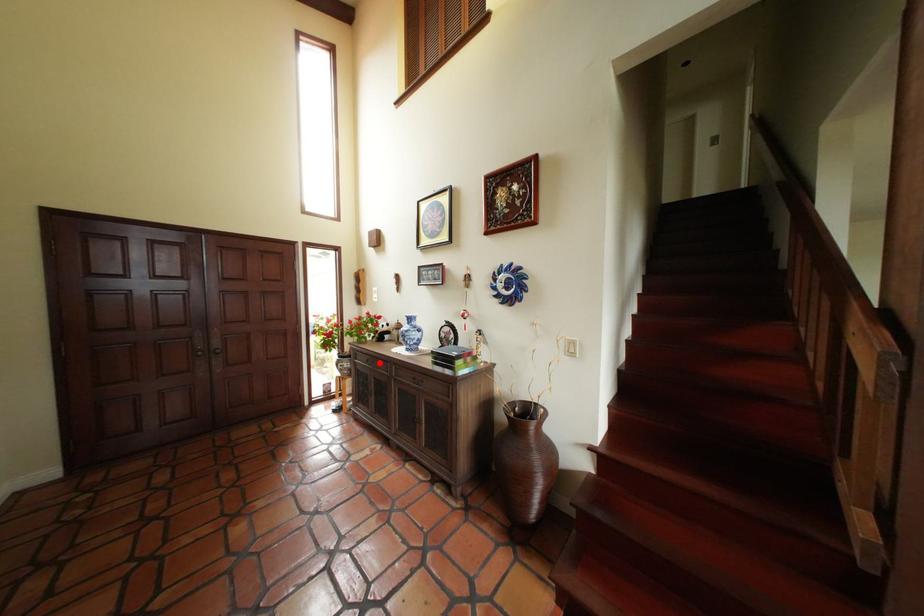
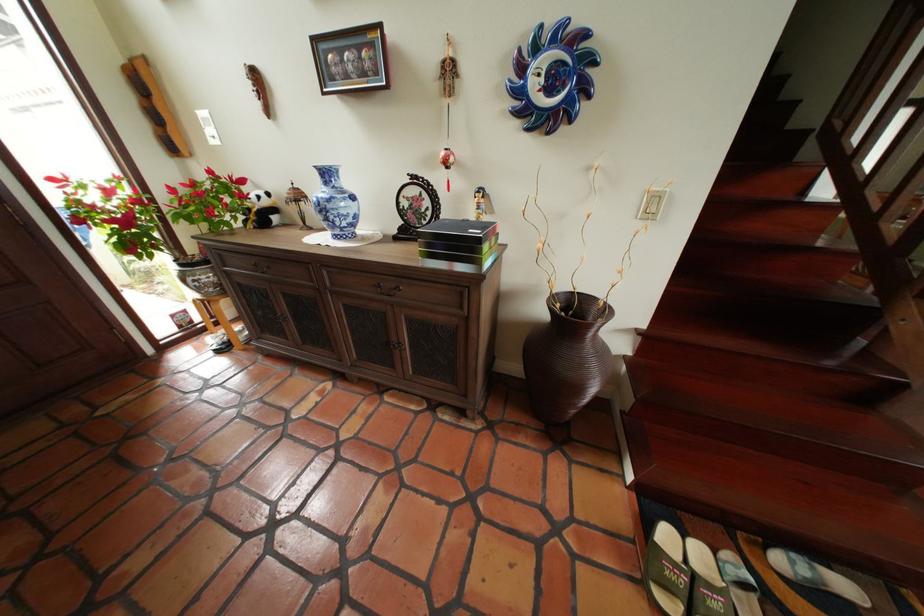
In the second image, find the point that corresponds to the highlighted location in the first image.

(266, 269)